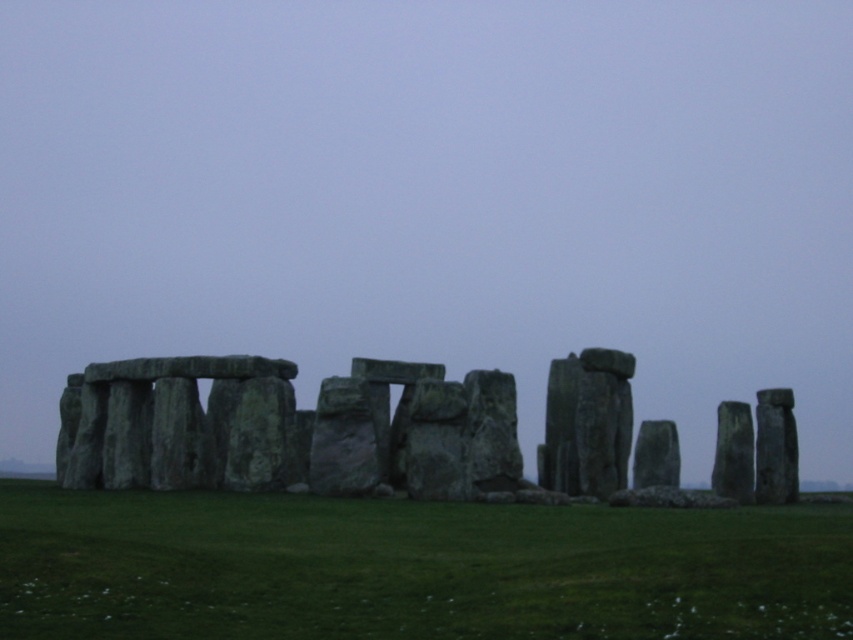
Question: Is green grass at center bigger than green stone at center?

Choices:
 (A) yes
 (B) no

Answer: (B)

Question: Can you confirm if green grass at center is bigger than green stone at center?

Choices:
 (A) no
 (B) yes

Answer: (A)

Question: Which point appears farthest from the camera in this image?

Choices:
 (A) (495, 525)
 (B) (144, 472)

Answer: (B)

Question: Observing the image, what is the correct spatial positioning of green grass at center in reference to green stone at center?

Choices:
 (A) right
 (B) left

Answer: (A)

Question: Which point is farther to the camera?

Choices:
 (A) (585, 582)
 (B) (120, 401)

Answer: (B)